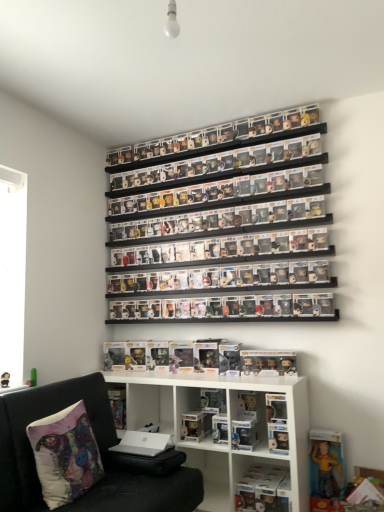
Question: From a real-world perspective, relative to white matte shelf at lower center, arranged as the first shelf when ordered from the bottom, is clear plastic figures at center, which ranks as the third shelf in bottom-to-top order, vertically above or below?

Choices:
 (A) below
 (B) above

Answer: (B)

Question: Do you think clear plastic figures at center, which appears as the 2th shelf when viewed from the top, is within white matte shelf at lower center, positioned as the 4th shelf in top-to-bottom order, or outside of it?

Choices:
 (A) inside
 (B) outside

Answer: (B)

Question: Which is farther from the yellow fabric figure at lower right, which is the third toy from top to bottom?

Choices:
 (A) matte plastic figurine at center, the 2th toy from the top
 (B) clear plastic figures at upper center, the fourth shelf ordered from the bottom
 (C) black fabric couch at lower left
 (D) translucent plastic figures at lower center, marked as the second toy in a left-to-right arrangement
 (E) white matte shelf at lower center, positioned as the 4th shelf in top-to-bottom order

Answer: (B)

Question: Which of these objects is positioned farthest from the matte plastic figurine at center, positioned as the 1th toy in left-to-right order?

Choices:
 (A) clear plastic figures at center, which ranks as the third shelf in bottom-to-top order
 (B) clear plastic figure at lower center
 (C) clear plastic figures at upper center, the fourth shelf ordered from the bottom
 (D) clear plastic figures at center, the 2th shelf ordered from the bottom
 (E) white matte shelf at lower center, arranged as the first shelf when ordered from the bottom

Answer: (C)